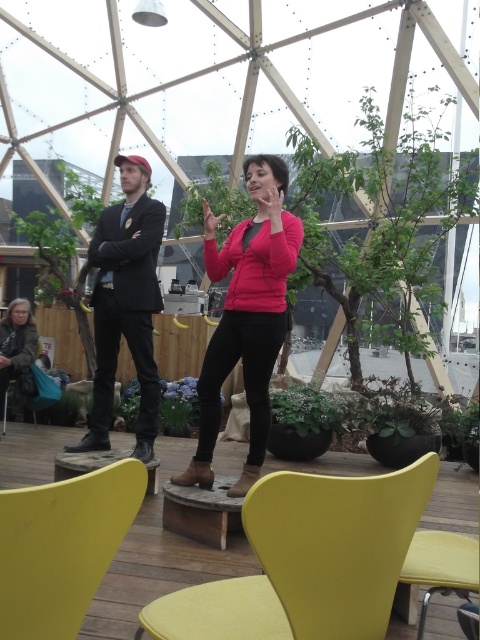
Question: In this image, where is yellow fabric chair at lower center located relative to matte pink sweater at center?

Choices:
 (A) left
 (B) right

Answer: (B)

Question: Which point is farther to the camera?

Choices:
 (A) yellow matte chair at lower left
 (B) leather jacket at lower left
 (C) matte black suit at left

Answer: (B)

Question: Which point is farther from the camera taking this photo?

Choices:
 (A) (420, 538)
 (B) (142, 460)
 (C) (233, 592)
 (D) (57, 524)

Answer: (B)

Question: Does yellow fabric chair at lower center appear on the left side of yellow fabric chair at lower right?

Choices:
 (A) yes
 (B) no

Answer: (A)

Question: Does yellow fabric chair at lower center appear under leather jacket at lower left?

Choices:
 (A) no
 (B) yes

Answer: (B)

Question: Among these points, which one is farthest from the camera?

Choices:
 (A) [x=0, y=417]
 (B) [x=153, y=435]
 (C) [x=282, y=337]
 (D) [x=387, y=477]

Answer: (A)